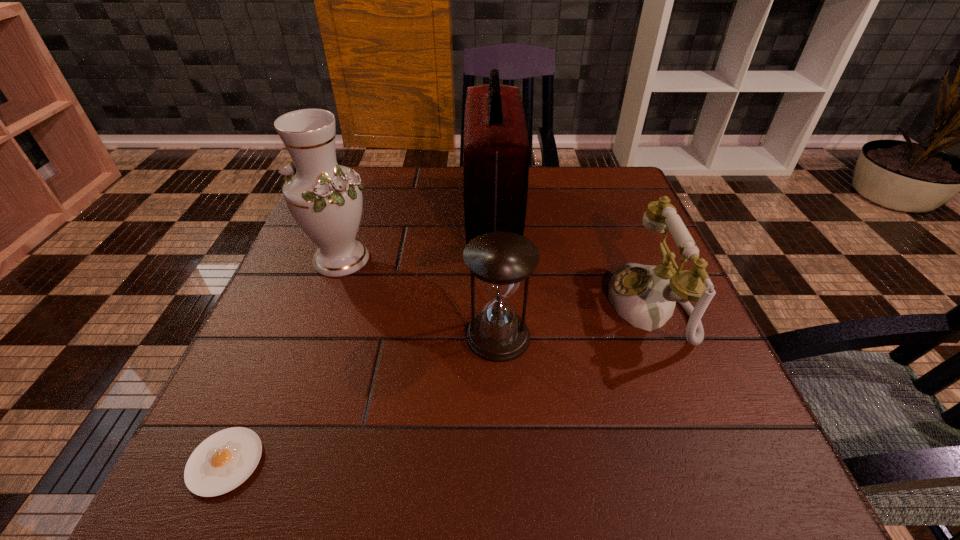
This screenshot has width=960, height=540. Identify the location of vacant space in between the hourglass and the telephone. (574, 320).

This screenshot has width=960, height=540. Identify the location of vacant region between the egg yolk and the hourglass. pos(362,399).

In order to click on vacant region between the hourglass and the vase in this screenshot , I will do `click(420, 298)`.

You are a GUI agent. You are given a task and a screenshot of the screen. Output one action in this format:
    pyautogui.click(x=<x>, y=<y>)
    Task: Click on the unoccupied area between the shortest object and the first aid kit
    This screenshot has width=960, height=540.
    Given the screenshot: What is the action you would take?
    pyautogui.click(x=359, y=337)

At what (x,y) coordinates should I click in order to perform the action: click on vacant area that lies between the telephone and the hourglass. Please return your answer as a coordinate pair (x, y). Looking at the image, I should click on (574, 320).

This screenshot has height=540, width=960. I want to click on object identified as the second closest to the telephone, so click(x=500, y=260).

At what (x,y) coordinates should I click in order to perform the action: click on object that is the closest to the hourglass. Please return your answer as a coordinate pair (x, y). This screenshot has height=540, width=960. Looking at the image, I should click on (645, 296).

Identify the location of vacant point that satisfies the following two spatial constraints: 1. on the dial of the telephone; 2. on the front side of the shortest object. The height and width of the screenshot is (540, 960). (712, 462).

Find the location of a particular element. free spot that satisfies the following two spatial constraints: 1. on the side of the first aid kit with the cross symbol; 2. on the back side of the hourglass is located at coordinates (497, 336).

Where is `free point that satisfies the following two spatial constraints: 1. on the side of the hourglass with the cross symbol; 2. on the left side of the first aid kit`? Image resolution: width=960 pixels, height=540 pixels. free point that satisfies the following two spatial constraints: 1. on the side of the hourglass with the cross symbol; 2. on the left side of the first aid kit is located at coordinates (497, 336).